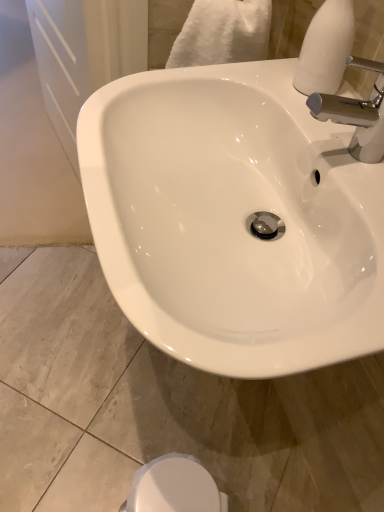
Locate an element on the screen. white glossy bidet at lower center is located at coordinates (174, 487).

At what (x,y) coordinates should I click in order to perform the action: click on white glossy sink at center. Please return your answer as a coordinate pair (x, y). This screenshot has height=512, width=384. Looking at the image, I should click on (233, 219).

Locate an element on the screen. white matte soap dispenser at upper right is located at coordinates (325, 48).

This screenshot has height=512, width=384. What are the coordinates of `white glossy bidet at lower center` in the screenshot? It's located at (174, 487).

What's the angular difference between white matte soap dispenser at upper right and white glossy bidet at lower center's facing directions?

white matte soap dispenser at upper right and white glossy bidet at lower center are facing 11.5 degrees away from each other.

Which is closer, (321, 89) or (140, 500)?

Point (321, 89) is closer to the camera than point (140, 500).

Which of these two, white matte soap dispenser at upper right or white glossy bidet at lower center, stands taller?

Standing taller between the two is white glossy bidet at lower center.

Consider the image. Is white matte soap dispenser at upper right facing towards white glossy bidet at lower center?

No, white matte soap dispenser at upper right does not turn towards white glossy bidet at lower center.

Which is more to the right, white glossy bidet at lower center or white glossy sink at center?

Positioned to the right is white glossy sink at center.

Is white glossy bidet at lower center taller or shorter than white glossy sink at center?

white glossy bidet at lower center is shorter than white glossy sink at center.

Which is behind, point (168, 459) or point (196, 136)?

The point (168, 459) is farther from the camera.

Does white glossy bidet at lower center have a lesser width compared to white glossy sink at center?

Yes, white glossy bidet at lower center is thinner than white glossy sink at center.

Considering the sizes of objects chrome metallic faucet at upper right and white glossy sink at center in the image provided, who is shorter, chrome metallic faucet at upper right or white glossy sink at center?

chrome metallic faucet at upper right is shorter.

Can you confirm if chrome metallic faucet at upper right is wider than white glossy sink at center?

In fact, chrome metallic faucet at upper right might be narrower than white glossy sink at center.

Is chrome metallic faucet at upper right at the left side of white glossy sink at center?

Incorrect, chrome metallic faucet at upper right is not on the left side of white glossy sink at center.

Is white glossy sink at center surrounded by chrome metallic faucet at upper right?

No, chrome metallic faucet at upper right does not contain white glossy sink at center.

Is white matte soap dispenser at upper right looking in the opposite direction of chrome metallic faucet at upper right?

No.

The image size is (384, 512). I want to click on tap in front of the white matte soap dispenser at upper right, so click(x=357, y=114).

Can you confirm if white matte soap dispenser at upper right is thinner than chrome metallic faucet at upper right?

Indeed, white matte soap dispenser at upper right has a lesser width compared to chrome metallic faucet at upper right.

Is white glossy bidet at lower center inside the boundaries of white matte soap dispenser at upper right, or outside?

white glossy bidet at lower center is outside white matte soap dispenser at upper right.

Is white glossy bidet at lower center turned away from white matte soap dispenser at upper right?

No, white glossy bidet at lower center's orientation is not away from white matte soap dispenser at upper right.

From a real-world perspective, which is physically above, white glossy bidet at lower center or white matte soap dispenser at upper right?

From a 3D spatial view, white matte soap dispenser at upper right is above.

Looking at the image, does white glossy bidet at lower center seem bigger or smaller compared to white matte soap dispenser at upper right?

white glossy bidet at lower center is bigger than white matte soap dispenser at upper right.

From a real-world perspective, is white glossy sink at center physically below white glossy bidet at lower center?

No, from a real-world perspective, white glossy sink at center is not beneath white glossy bidet at lower center.

Consider the image. Which is correct: white glossy sink at center is inside white glossy bidet at lower center, or outside of it?

white glossy sink at center cannot be found inside white glossy bidet at lower center.

Is white glossy bidet at lower center at the back of white glossy sink at center?

No, white glossy bidet at lower center is not at the back of white glossy sink at center.

Is white glossy sink at center shorter than white glossy bidet at lower center?

No.

Which object is thinner, chrome metallic faucet at upper right or white matte soap dispenser at upper right?

white matte soap dispenser at upper right is thinner.

Would you say white matte soap dispenser at upper right is part of chrome metallic faucet at upper right's contents?

No, chrome metallic faucet at upper right does not contain white matte soap dispenser at upper right.

Consider the image. Could you tell me if chrome metallic faucet at upper right is turned towards white matte soap dispenser at upper right?

No, chrome metallic faucet at upper right is not oriented towards white matte soap dispenser at upper right.

Is chrome metallic faucet at upper right shorter than white matte soap dispenser at upper right?

Correct, chrome metallic faucet at upper right is not as tall as white matte soap dispenser at upper right.

The height and width of the screenshot is (512, 384). Find the location of `soap dispenser above the white glossy bidet at lower center (from a real-world perspective)`. soap dispenser above the white glossy bidet at lower center (from a real-world perspective) is located at coordinates (325, 48).

I want to click on bidet below the white glossy sink at center (from a real-world perspective), so click(x=174, y=487).

From the image, which object appears to be farther from white glossy sink at center, white glossy bidet at lower center or white matte soap dispenser at upper right?

white glossy bidet at lower center is further to white glossy sink at center.

From the image, which object appears to be farther from white glossy sink at center, chrome metallic faucet at upper right or white matte soap dispenser at upper right?

white matte soap dispenser at upper right lies further to white glossy sink at center than the other object.

From the image, which object appears to be farther from chrome metallic faucet at upper right, white matte soap dispenser at upper right or white glossy bidet at lower center?

Among the two, white glossy bidet at lower center is located further to chrome metallic faucet at upper right.

Based on their spatial positions, is white matte soap dispenser at upper right or chrome metallic faucet at upper right closer to white glossy bidet at lower center?

chrome metallic faucet at upper right.

Considering their positions, is white glossy sink at center positioned further to chrome metallic faucet at upper right than white matte soap dispenser at upper right?

white glossy sink at center is further to chrome metallic faucet at upper right.

Estimate the real-world distances between objects in this image. Which object is closer to white glossy bidet at lower center, chrome metallic faucet at upper right or white matte soap dispenser at upper right?

chrome metallic faucet at upper right is positioned closer to the anchor white glossy bidet at lower center.

In the scene shown: Based on their spatial positions, is chrome metallic faucet at upper right or white glossy bidet at lower center further from white glossy sink at center?

white glossy bidet at lower center.

Based on their spatial positions, is white glossy bidet at lower center or chrome metallic faucet at upper right closer to white glossy sink at center?

Based on the image, chrome metallic faucet at upper right appears to be nearer to white glossy sink at center.

Image resolution: width=384 pixels, height=512 pixels. I want to click on tap between white matte soap dispenser at upper right and white glossy sink at center vertically, so click(357, 114).

Where is `sink that lies between white matte soap dispenser at upper right and white glossy bidet at lower center from top to bottom`? sink that lies between white matte soap dispenser at upper right and white glossy bidet at lower center from top to bottom is located at coordinates (233, 219).

Identify the location of sink between chrome metallic faucet at upper right and white glossy bidet at lower center in the up-down direction. The image size is (384, 512). (233, 219).

Locate an element on the screen. tap that lies between white matte soap dispenser at upper right and white glossy bidet at lower center from top to bottom is located at coordinates (357, 114).